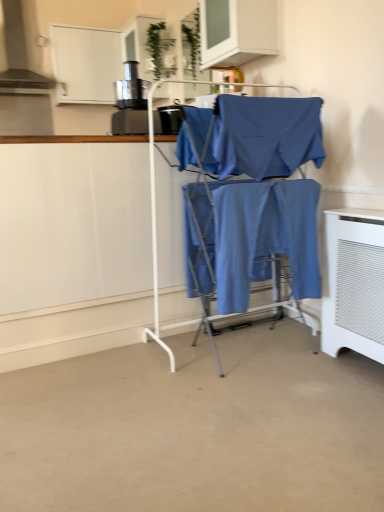
Question: Can we say blue cotton pants at center, which is counted as the second fabric, starting from the top, lies outside metallic black coffee machine at upper left?

Choices:
 (A) yes
 (B) no

Answer: (A)

Question: Is blue cotton pants at center, the first fabric when ordered from bottom to top, positioned in front of metallic black coffee machine at upper left?

Choices:
 (A) yes
 (B) no

Answer: (A)

Question: Does blue cotton pants at center, which is counted as the second fabric, starting from the top, turn towards metallic black coffee machine at upper left?

Choices:
 (A) yes
 (B) no

Answer: (B)

Question: From a real-world perspective, does blue cotton pants at center, which is counted as the second fabric, starting from the top, stand above metallic black coffee machine at upper left?

Choices:
 (A) yes
 (B) no

Answer: (B)

Question: Considering the relative positions of blue cotton pants at center, which is counted as the second fabric, starting from the top, and metallic black coffee machine at upper left in the image provided, is blue cotton pants at center, which is counted as the second fabric, starting from the top, to the right of metallic black coffee machine at upper left from the viewer's perspective?

Choices:
 (A) yes
 (B) no

Answer: (A)

Question: Is metallic black coffee machine at upper left bigger or smaller than blue cotton fabric at center, the first fabric in the top-to-bottom sequence?

Choices:
 (A) big
 (B) small

Answer: (B)

Question: Considering the positions of point (114, 129) and point (306, 103), is point (114, 129) closer or farther from the camera than point (306, 103)?

Choices:
 (A) closer
 (B) farther

Answer: (B)

Question: Is metallic black coffee machine at upper left wider or thinner than blue cotton fabric at center, the first fabric in the top-to-bottom sequence?

Choices:
 (A) wide
 (B) thin

Answer: (A)

Question: Based on their positions, is metallic black coffee machine at upper left located to the left or right of blue cotton fabric at center, the first fabric in the top-to-bottom sequence?

Choices:
 (A) right
 (B) left

Answer: (B)

Question: Is point (340, 328) positioned closer to the camera than point (319, 271)?

Choices:
 (A) closer
 (B) farther

Answer: (A)

Question: From the image's perspective, relative to blue cotton pants at center, which is counted as the second fabric, starting from the top, is white mesh radiator at lower right above or below?

Choices:
 (A) above
 (B) below

Answer: (B)

Question: Considering the relative positions of white mesh radiator at lower right and blue cotton pants at center, which is counted as the second fabric, starting from the top, in the image provided, is white mesh radiator at lower right to the left or to the right of blue cotton pants at center, which is counted as the second fabric, starting from the top,?

Choices:
 (A) right
 (B) left

Answer: (A)

Question: Looking at the image, does white mesh radiator at lower right seem bigger or smaller compared to blue cotton pants at center, which is counted as the second fabric, starting from the top?

Choices:
 (A) big
 (B) small

Answer: (A)

Question: Choose the correct answer: Is blue cotton fabric at center, the first fabric in the top-to-bottom sequence, inside white mesh radiator at lower right or outside it?

Choices:
 (A) inside
 (B) outside

Answer: (B)

Question: Relative to white mesh radiator at lower right, is blue cotton fabric at center, the first fabric in the top-to-bottom sequence, in front or behind?

Choices:
 (A) front
 (B) behind

Answer: (A)